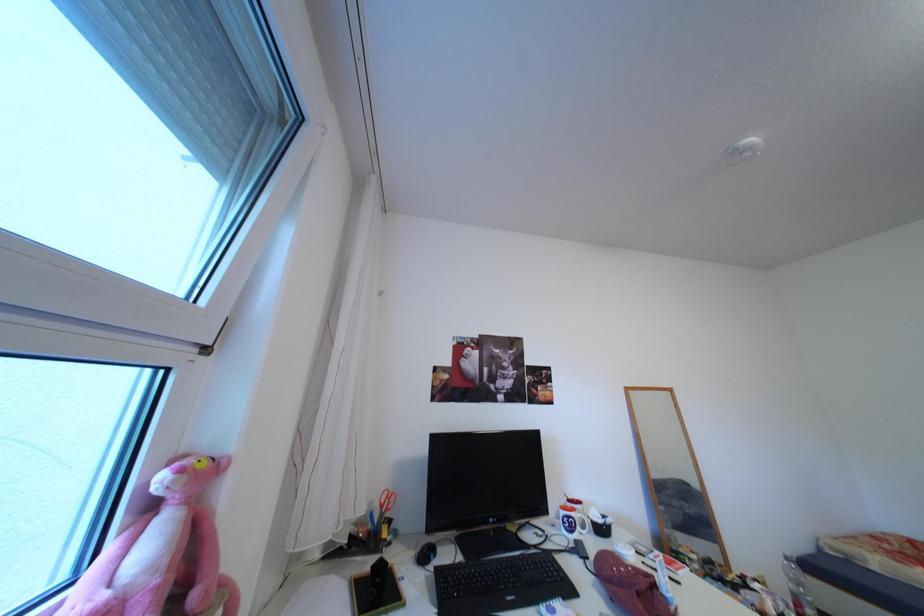
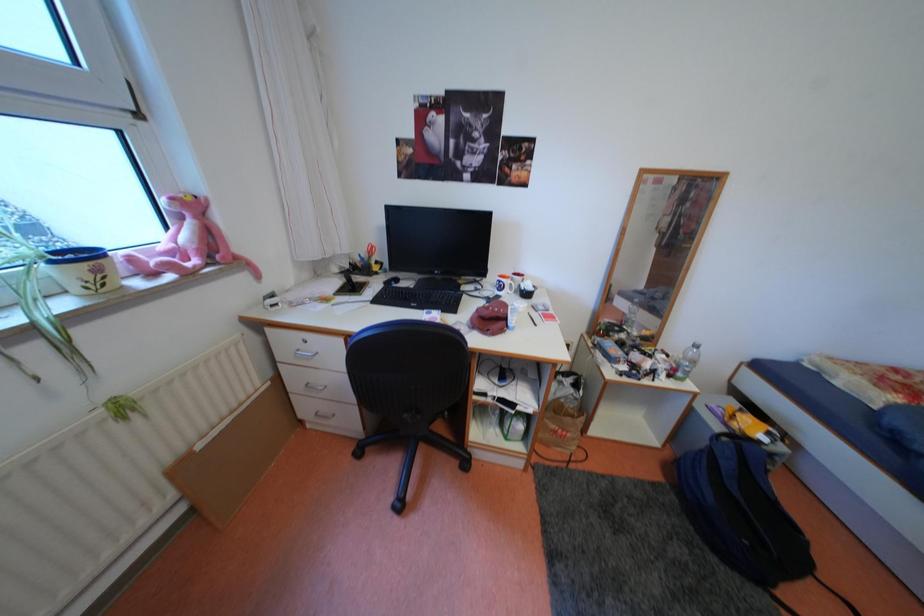
Based on the continuous images, in which direction is the camera rotating?

The rotation direction of the camera is left-down.